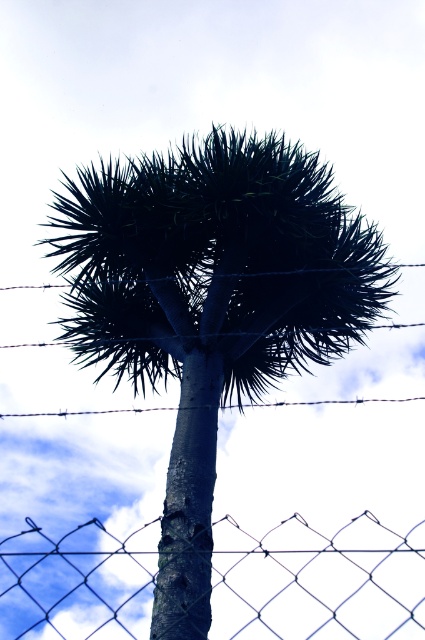
Is wire mesh fence at center closer to the viewer compared to barbed wire at center?

Yes.

Is wire mesh fence at center below barbed wire at center?

Indeed, wire mesh fence at center is positioned under barbed wire at center.

Measure the distance between wire mesh fence at center and camera.

wire mesh fence at center and camera are 11.03 meters apart.

Locate an element on the screen. wire mesh fence at center is located at coordinates (317, 580).

From the picture: Is dark green textured palm tree at center thinner than wire mesh fence at center?

No.

Can you confirm if dark green textured palm tree at center is wider than wire mesh fence at center?

Correct, the width of dark green textured palm tree at center exceeds that of wire mesh fence at center.

Who is more distant from viewer, (367,316) or (286,552)?

Point (286,552)

The width and height of the screenshot is (425, 640). In order to click on dark green textured palm tree at center in this screenshot , I will do `click(210, 304)`.

Between point (204, 348) and point (274, 403), which one is positioned behind?

The point (274, 403) is behind.

Is the position of dark green textured palm tree at center more distant than that of barbed wire at center?

No, it is in front of barbed wire at center.

Between point (181, 202) and point (61, 413), which one is positioned behind?

The point (61, 413) is behind.

This screenshot has width=425, height=640. I want to click on dark green textured palm tree at center, so click(x=210, y=304).